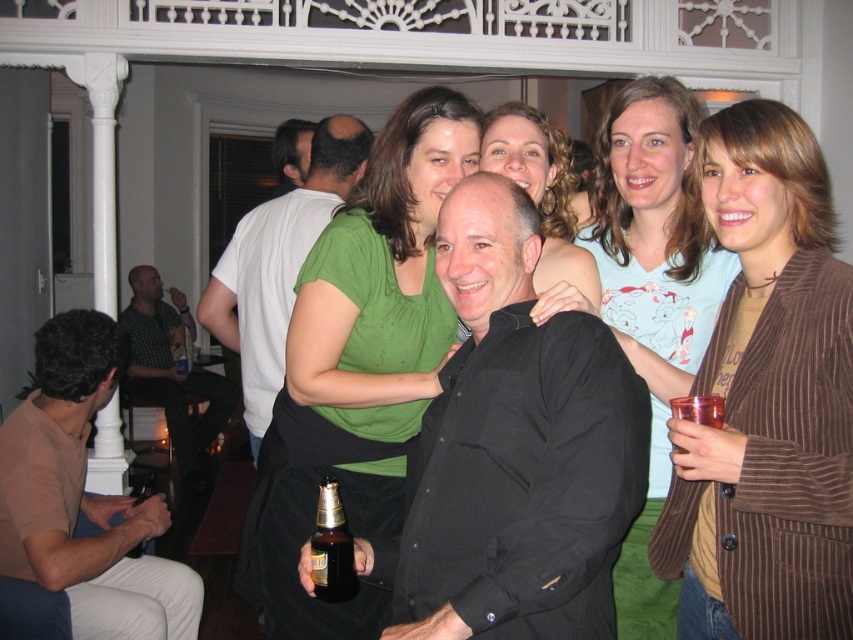
Does white matte shirt at center have a smaller size compared to brown glass bottle at center?

No, white matte shirt at center is not smaller than brown glass bottle at center.

Can you confirm if white matte shirt at center is positioned to the right of brown glass bottle at center?

Incorrect, white matte shirt at center is not on the right side of brown glass bottle at center.

Does point (252, 396) come farther from viewer compared to point (316, 592)?

Yes, point (252, 396) is farther from viewer.

Identify the location of white matte shirt at center. (277, 266).

Based on the photo, which is below, brown corduroy blazer at center or white matte shirt at center?

brown corduroy blazer at center is below.

Who is positioned more to the right, brown corduroy blazer at center or white matte shirt at center?

From the viewer's perspective, brown corduroy blazer at center appears more on the right side.

Which is in front, point (752, 513) or point (277, 220)?

Positioned in front is point (752, 513).

Locate an element on the screen. The image size is (853, 640). brown corduroy blazer at center is located at coordinates (766, 401).

Which is more to the left, green matte shirt at upper center or brown glass bottle at center?

brown glass bottle at center

From the picture: Is green matte shirt at upper center in front of brown glass bottle at center?

Yes, it is.

Where is `green matte shirt at upper center`? green matte shirt at upper center is located at coordinates (543, 204).

At what (x,y) coordinates should I click in order to perform the action: click on green matte shirt at upper center. Please return your answer as a coordinate pair (x, y). This screenshot has height=640, width=853. Looking at the image, I should click on (543, 204).